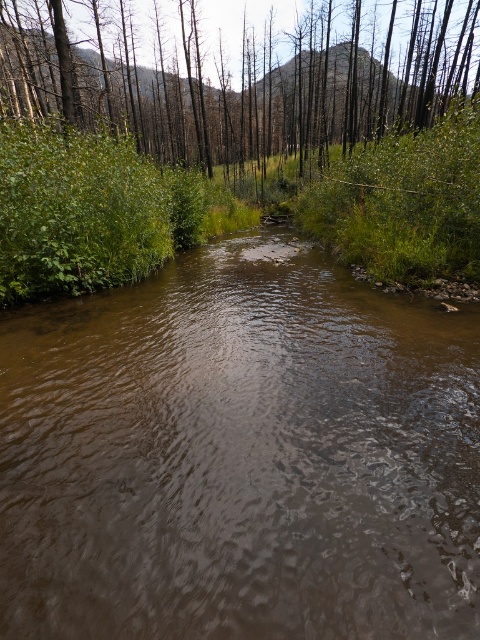
Question: Can you confirm if brown smooth stream at center is bigger than green matte tree at upper center?

Choices:
 (A) yes
 (B) no

Answer: (B)

Question: Can you confirm if brown smooth stream at center is positioned below green matte tree at upper center?

Choices:
 (A) no
 (B) yes

Answer: (B)

Question: Which of the following is the closest to the observer?

Choices:
 (A) (232, 602)
 (B) (427, 81)

Answer: (A)

Question: Which object is farther from the camera taking this photo?

Choices:
 (A) brown smooth stream at center
 (B) green matte tree at upper center

Answer: (B)

Question: Is brown smooth stream at center wider than green matte tree at upper center?

Choices:
 (A) yes
 (B) no

Answer: (B)